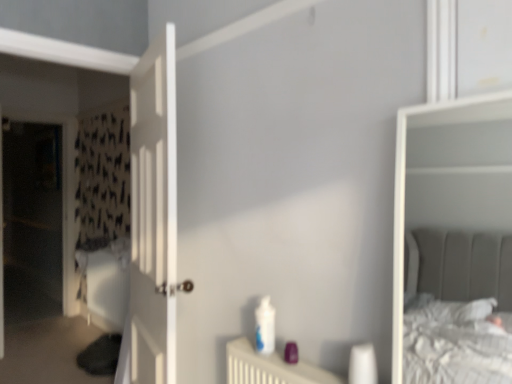
Question: Does point pyautogui.click(x=12, y=276) appear closer or farther from the camera than point pyautogui.click(x=266, y=342)?

Choices:
 (A) closer
 (B) farther

Answer: (B)

Question: Is transparent plastic screen door at left inside or outside of white glossy bottle at center?

Choices:
 (A) outside
 (B) inside

Answer: (A)

Question: Which object is positioned closest to the white wooden door at left?

Choices:
 (A) transparent plastic screen door at left
 (B) white glossy bottle at center

Answer: (B)

Question: Which object is positioned closest to the transparent plastic screen door at left?

Choices:
 (A) white wooden door at left
 (B) white glossy bottle at center

Answer: (A)